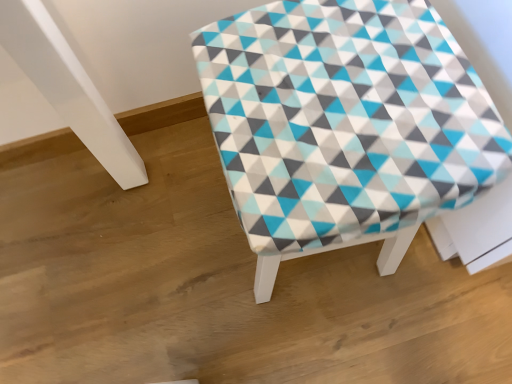
Where is `free space in front of matte fabric stool at center`? The height and width of the screenshot is (384, 512). free space in front of matte fabric stool at center is located at coordinates (354, 343).